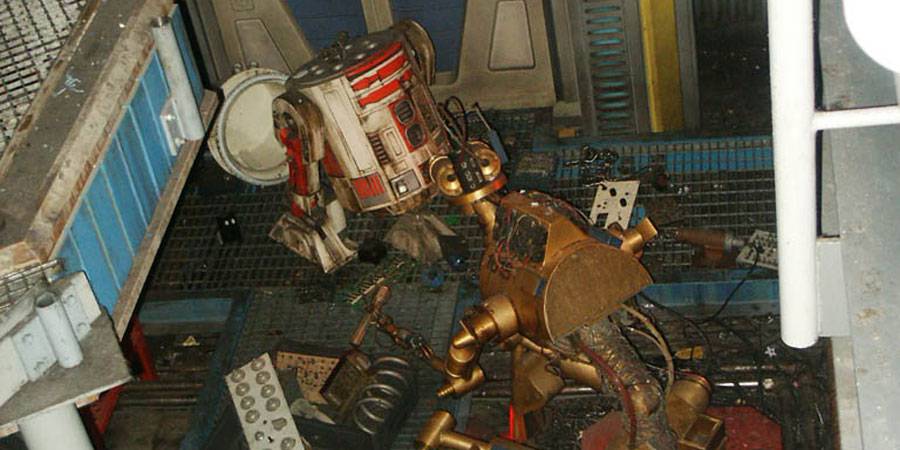
At what (x,y) coordinates should I click in order to perform the action: click on wires. Please return your answer as a coordinate pair (x, y). The image size is (900, 450). Looking at the image, I should click on (774, 379).